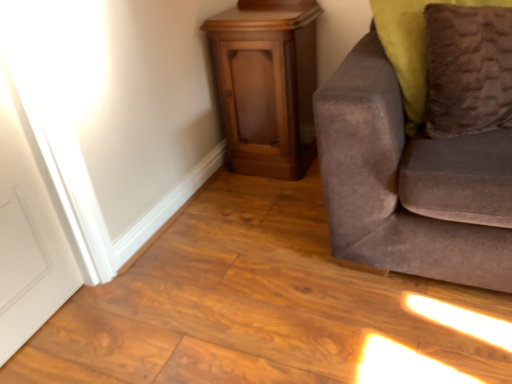
Question: In the image, is brown fuzzy pillow at right positioned in front of or behind wooden cabinet at center?

Choices:
 (A) front
 (B) behind

Answer: (A)

Question: Is brown fuzzy pillow at right inside the boundaries of wooden cabinet at center, or outside?

Choices:
 (A) inside
 (B) outside

Answer: (B)

Question: Estimate the real-world distances between objects in this image. Which object is farther from the brown fuzzy pillow at right?

Choices:
 (A) suede gray couch at right
 (B) wooden cabinet at center

Answer: (B)

Question: Which is nearer to the suede gray couch at right?

Choices:
 (A) wooden cabinet at center
 (B) brown fuzzy pillow at right

Answer: (B)